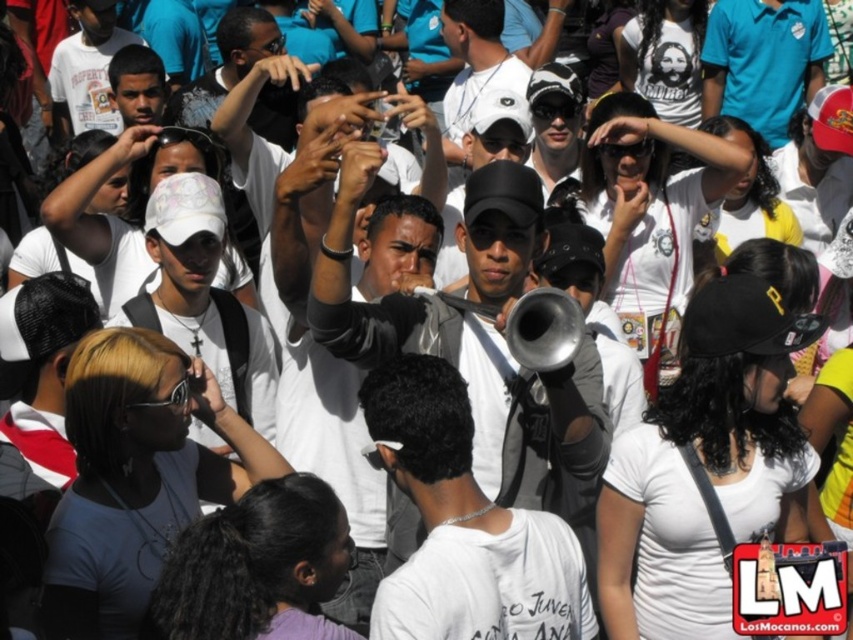
Does metallic megaphone at center appear on the right side of metallic silver megaphone at center?

Incorrect, metallic megaphone at center is not on the right side of metallic silver megaphone at center.

Is point (352, 176) closer to camera compared to point (537, 525)?

No, (352, 176) is behind (537, 525).

Who is more distant from viewer, (590, 408) or (431, 536)?

The point (590, 408) is more distant.

I want to click on metallic megaphone at center, so click(436, 292).

Can you confirm if metallic silver megaphone at center is positioned above black plastic goggles at lower left?

Actually, metallic silver megaphone at center is below black plastic goggles at lower left.

Which of these two, metallic silver megaphone at center or black plastic goggles at lower left, stands taller?

black plastic goggles at lower left is taller.

Between point (463, 506) and point (169, 404), which one is positioned behind?

The point (169, 404) is behind.

The height and width of the screenshot is (640, 853). Identify the location of metallic silver megaphone at center. (463, 525).

Can you confirm if metallic megaphone at center is positioned above white t-shirt at center?

Incorrect, metallic megaphone at center is not positioned above white t-shirt at center.

Is metallic megaphone at center wider than white t-shirt at center?

Yes.

Where is `metallic megaphone at center`? This screenshot has height=640, width=853. metallic megaphone at center is located at coordinates [x=436, y=292].

At what (x,y) coordinates should I click in order to perform the action: click on metallic megaphone at center. Please return your answer as a coordinate pair (x, y). The image size is (853, 640). Looking at the image, I should click on (436, 292).